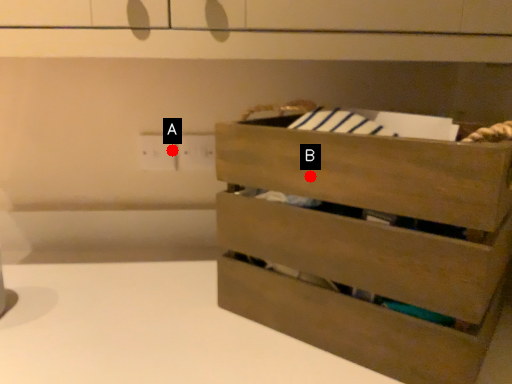
Question: Two points are circled on the image, labeled by A and B beside each circle. Which point is closer to the camera?

Choices:
 (A) A is closer
 (B) B is closer

Answer: (B)